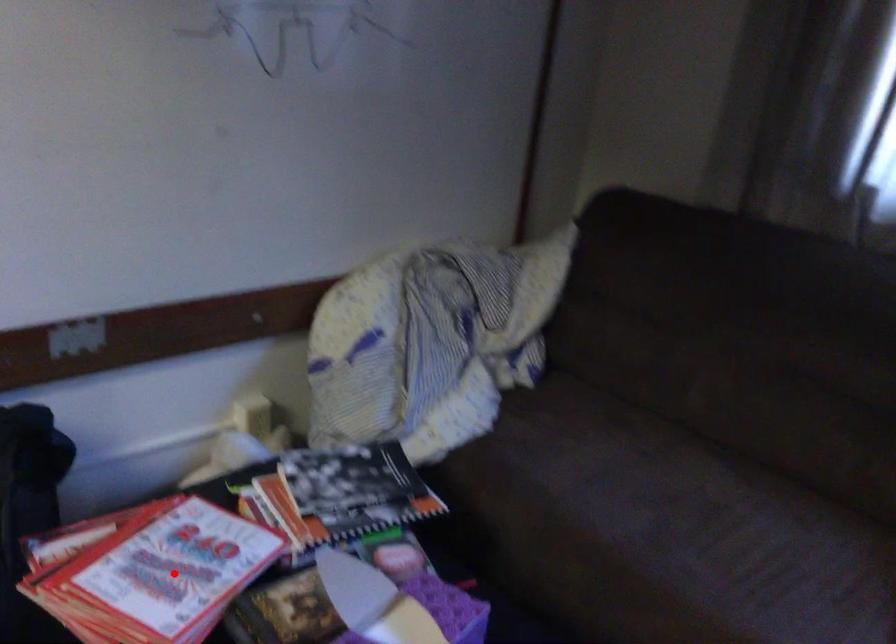
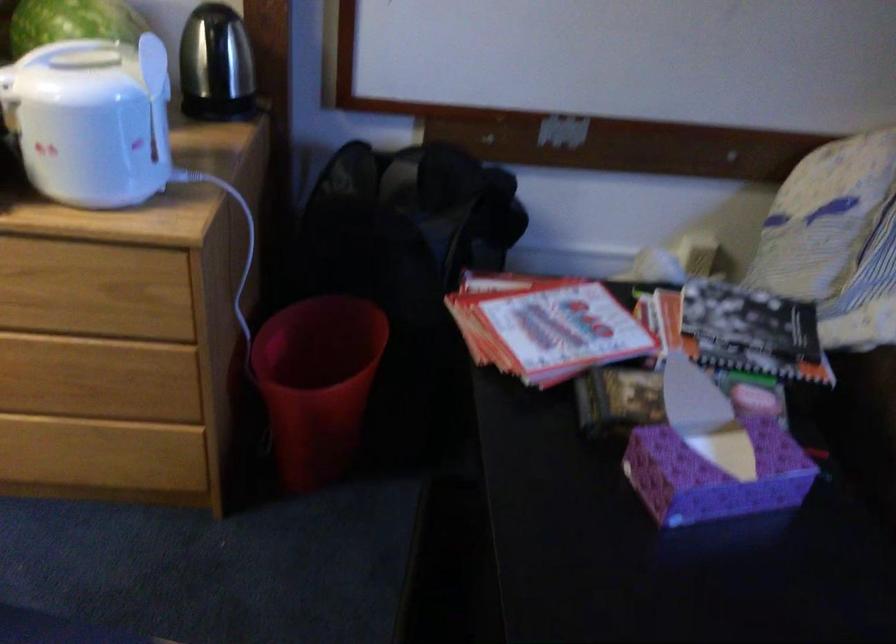
Where in the second image is the point corresponding to the highlighted location from the first image?

(545, 326)